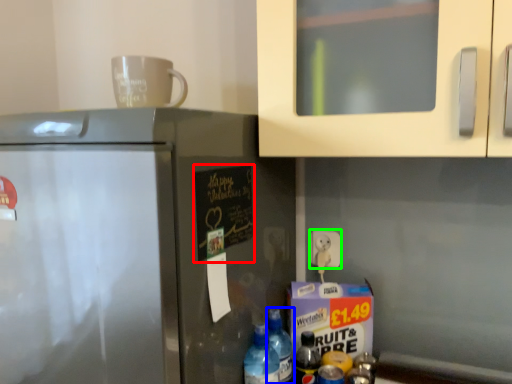
Question: Considering the real-world distances, which object is closest to bulletin board (highlighted by a red box)? bottle (highlighted by a blue box) or electric outlet (highlighted by a green box).

Choices:
 (A) bottle
 (B) electric outlet

Answer: (A)